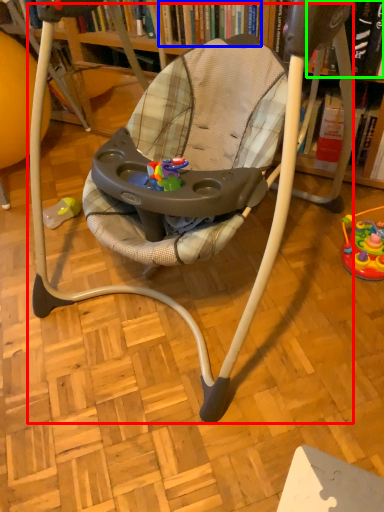
Question: Based on their relative distances, which object is farther from baby carriage (highlighted by a red box)? Choose from book (highlighted by a blue box) and book (highlighted by a green box).

Choices:
 (A) book
 (B) book

Answer: (B)